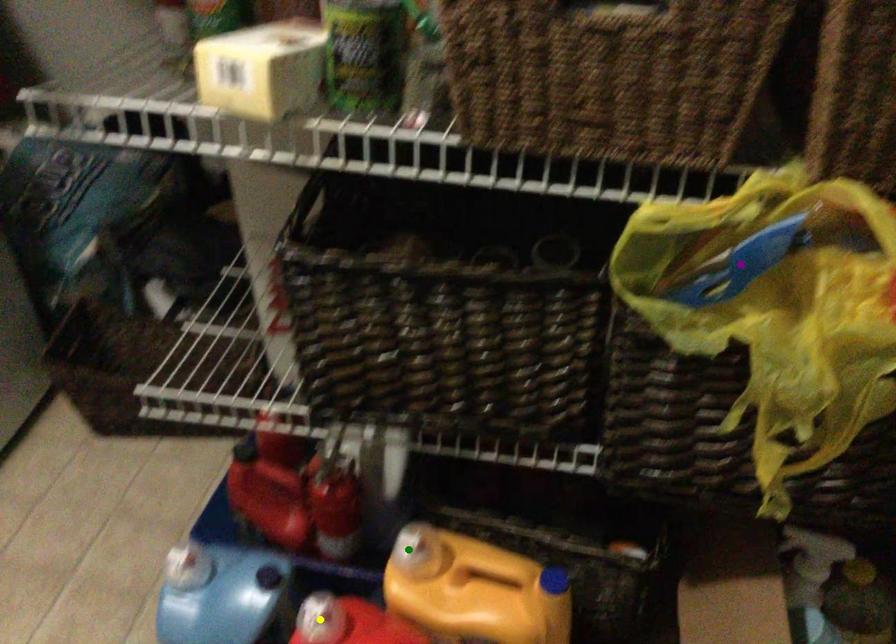
Order these from nearest to farthest:
green point | purple point | yellow point

green point, yellow point, purple point